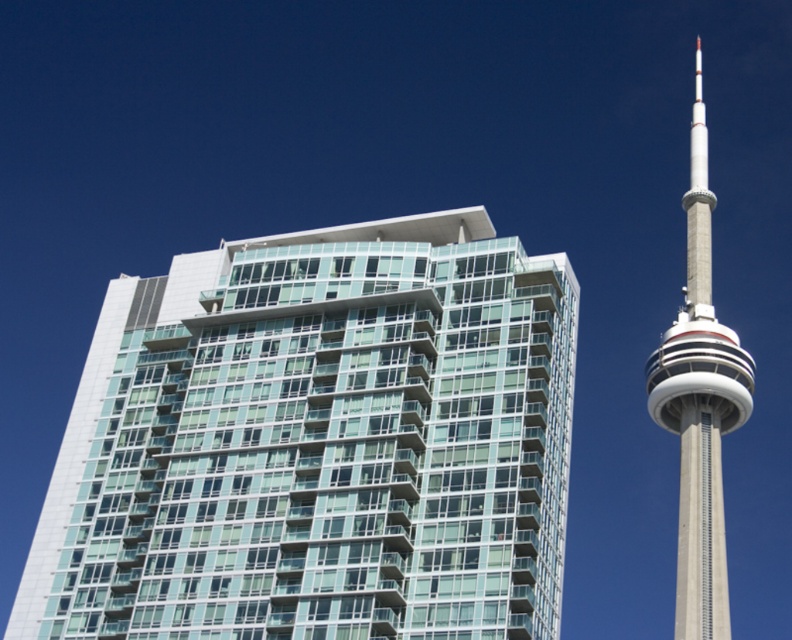
Is glassy teal building at center bigger than concrete tower at right?

No.

Who is lower down, glassy teal building at center or concrete tower at right?

concrete tower at right is below.

This screenshot has height=640, width=792. In order to click on glassy teal building at center in this screenshot , I will do `click(318, 444)`.